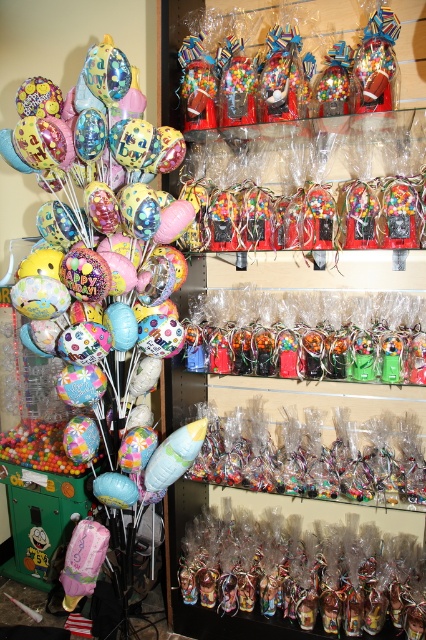
Question: Does matte pastel balloons at left appear on the left side of translucent plastic figurines at center?

Choices:
 (A) no
 (B) yes

Answer: (B)

Question: Can you confirm if matte pastel balloons at left is wider than translucent plastic figurines at center?

Choices:
 (A) yes
 (B) no

Answer: (B)

Question: Is matte pastel balloons at left to the right of translucent plastic figurines at center from the viewer's perspective?

Choices:
 (A) no
 (B) yes

Answer: (A)

Question: Which of the following is the farthest from the observer?

Choices:
 (A) matte pastel balloons at left
 (B) translucent plastic figurines at center

Answer: (B)

Question: Which point is closer to the camera?

Choices:
 (A) (104, 289)
 (B) (402, 586)

Answer: (A)